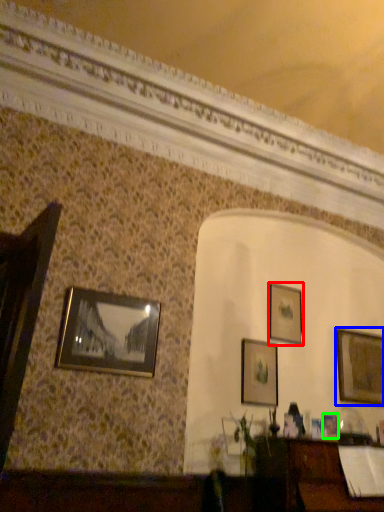
Question: Which object is the farthest from picture frame (highlighted by a red box)? Choose among these: picture frame (highlighted by a blue box) or picture frame (highlighted by a green box).

Choices:
 (A) picture frame
 (B) picture frame

Answer: (B)